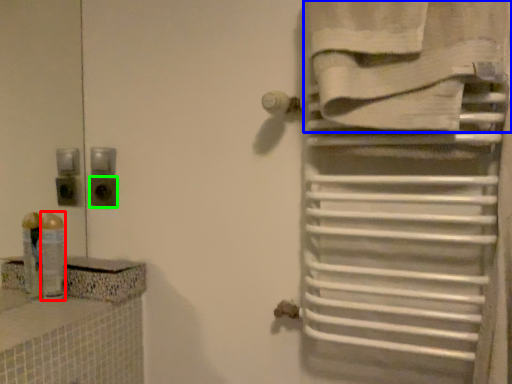
Question: Which is nearer to the toiletry (highlighted by a red box)? towel (highlighted by a blue box) or electric outlet (highlighted by a green box).

Choices:
 (A) towel
 (B) electric outlet

Answer: (B)